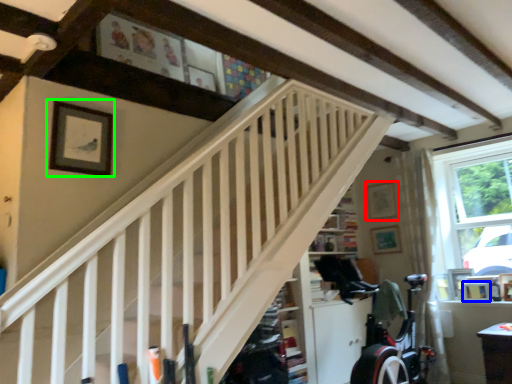
Question: Estimate the real-world distances between objects in this image. Which object is farther from picture frame (highlighted by a red box), picture frame (highlighted by a blue box) or picture frame (highlighted by a green box)?

Choices:
 (A) picture frame
 (B) picture frame

Answer: (B)